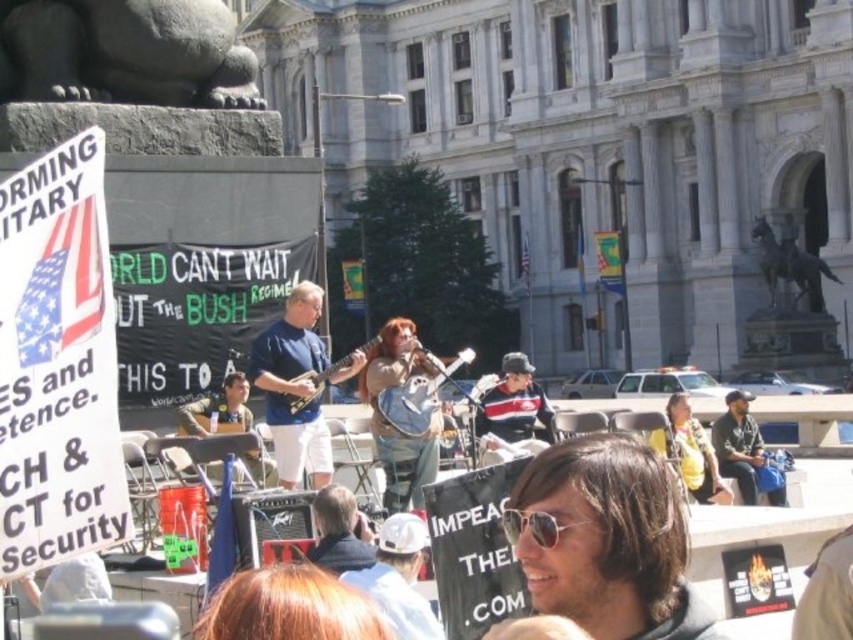
Is white matte baseball cap at center wider than striped knit sweater at center?

No, white matte baseball cap at center is not wider than striped knit sweater at center.

In order to click on white matte baseball cap at center in this screenshot , I will do `click(399, 577)`.

Who is more forward, (424, 397) or (320, 394)?

Point (320, 394)

Which is behind, point (421, 413) or point (300, 406)?

Point (421, 413)

Where is `matte white guitar at center`? This screenshot has height=640, width=853. matte white guitar at center is located at coordinates (418, 396).

Who is more forward, (621, 573) or (306, 461)?

Point (621, 573) is in front.

Does sunglasses at center have a greater height compared to blue fabric guitar at center?

In fact, sunglasses at center may be shorter than blue fabric guitar at center.

Where is `sunglasses at center`? The width and height of the screenshot is (853, 640). sunglasses at center is located at coordinates (606, 540).

Where is `sunglasses at center`? This screenshot has height=640, width=853. sunglasses at center is located at coordinates (606, 540).